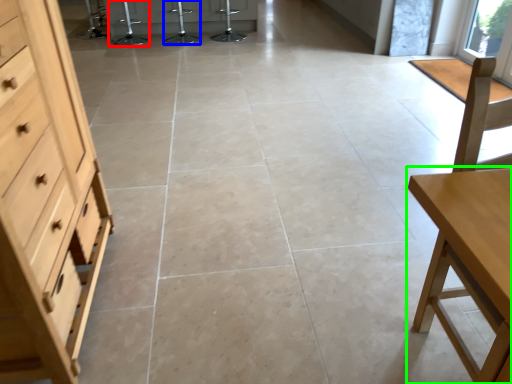
Question: Which is farther away from bar stool (highlighted by a red box)? bar stool (highlighted by a blue box) or table (highlighted by a green box)?

Choices:
 (A) bar stool
 (B) table

Answer: (B)